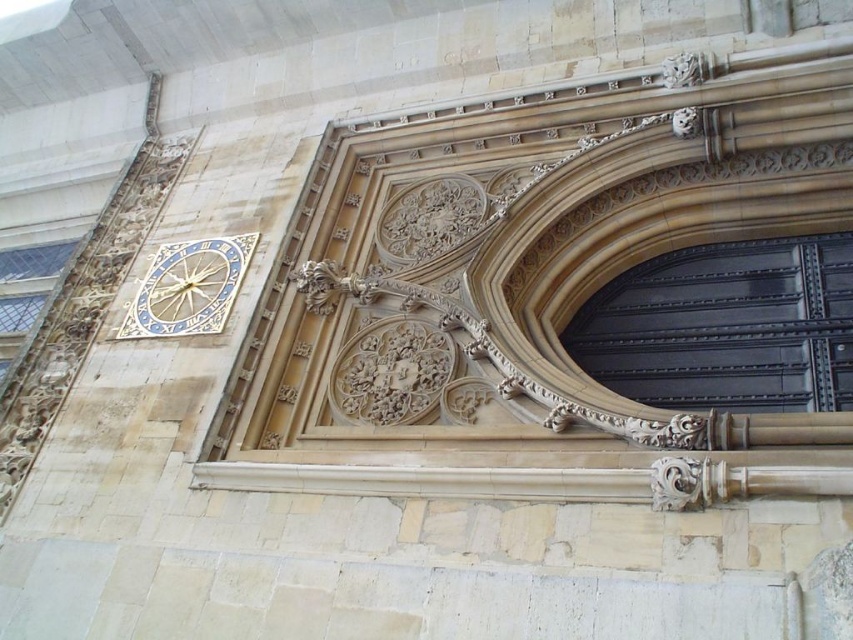
Question: Is brown stone archway at center below gold metallic clock at upper left?

Choices:
 (A) yes
 (B) no

Answer: (B)

Question: Can you confirm if brown stone archway at center is smaller than black metal gate at center?

Choices:
 (A) yes
 (B) no

Answer: (B)

Question: Which point appears farthest from the camera in this image?

Choices:
 (A) (694, 278)
 (B) (190, 292)

Answer: (B)

Question: Estimate the real-world distances between objects in this image. Which object is farther from the brown stone archway at center?

Choices:
 (A) black metal gate at center
 (B) gold metallic clock at upper left

Answer: (B)

Question: Which object is closer to the camera taking this photo?

Choices:
 (A) gold metallic clock at upper left
 (B) brown stone archway at center
 (C) black metal gate at center

Answer: (B)

Question: Is brown stone archway at center bigger than gold metallic clock at upper left?

Choices:
 (A) yes
 (B) no

Answer: (A)